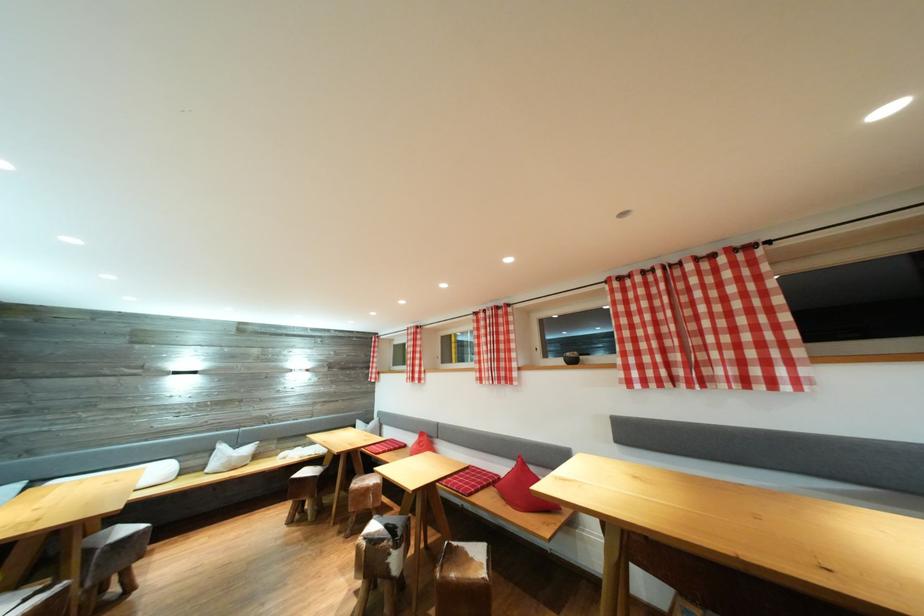
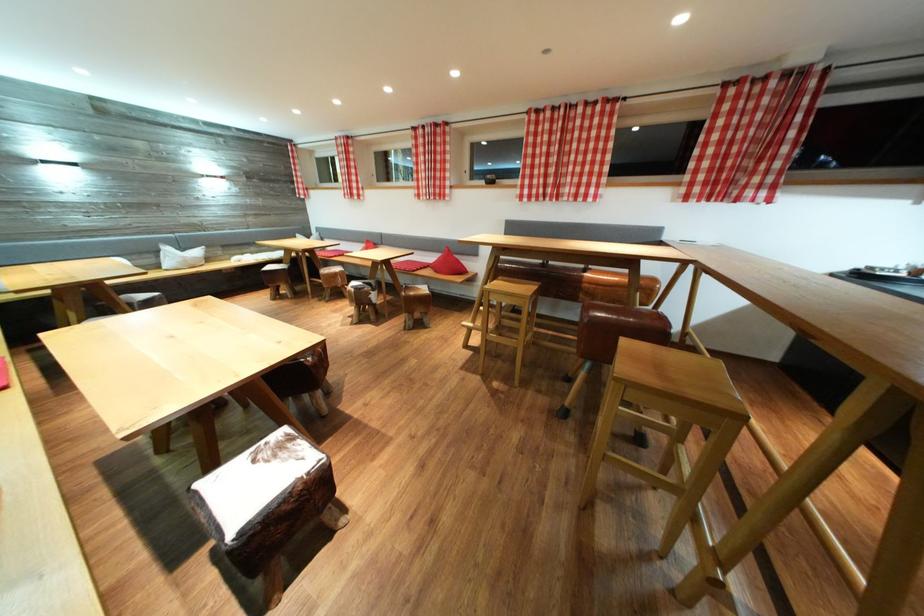
Find the pixel in the second image that matches the point at 228,453 in the first image.

(176, 254)